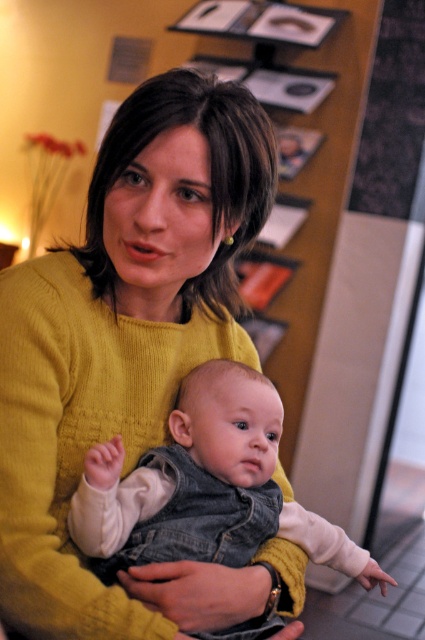
You are a photographer trying to capture a closeup of the yellow knitted sweater at center and the denim vest at center. Since you can only focus on one object at a time, which one should you choose to ensure the other remains in the background?

The yellow knitted sweater at center is closer to the viewer than the denim vest at center, so focusing on the yellow knitted sweater at center will keep the denim vest at center in the background.

In the scene shown: You are a tailor trying to determine which garment has a greater width to decide which requires more fabric. The woman is wearing a yellow knitted sweater at center and the baby is wearing a denim vest at center. Which garment has a larger width?

The yellow knitted sweater at center has a larger width than the denim vest at center, so it requires more fabric.